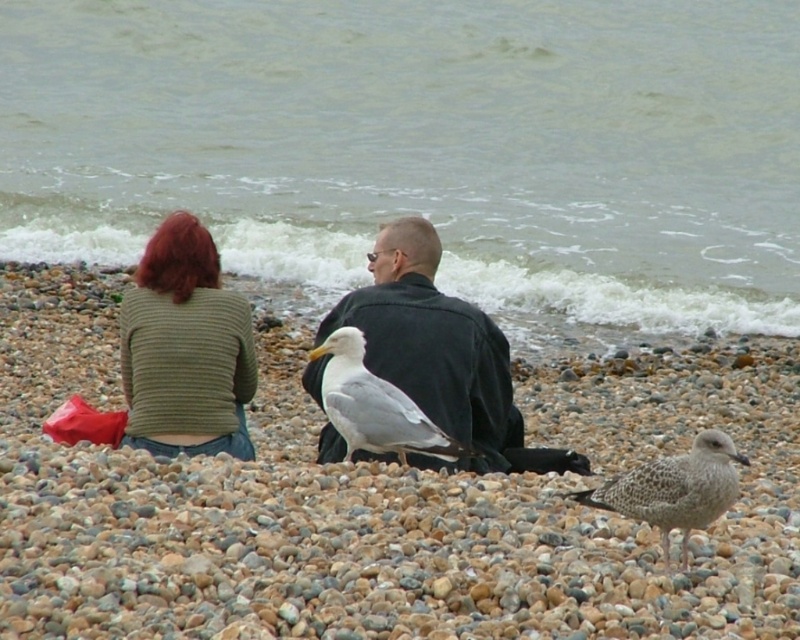
Question: Among these objects, which one is farthest from the camera?

Choices:
 (A) black matte jacket at center
 (B) speckled feathered seagull at lower right
 (C) gray water at center

Answer: (C)

Question: Which point is closer to the camera taking this photo?

Choices:
 (A) (256, 52)
 (B) (440, 429)
 (C) (780, 397)

Answer: (B)

Question: Is smooth pebbles at center to the left of black matte jacket at center from the viewer's perspective?

Choices:
 (A) no
 (B) yes

Answer: (B)

Question: Is green knitted sweater at lower left smaller than speckled feathered seagull at lower right?

Choices:
 (A) no
 (B) yes

Answer: (A)

Question: Does smooth pebbles at center have a greater width compared to black matte jacket at center?

Choices:
 (A) no
 (B) yes

Answer: (A)

Question: Which object appears farthest from the camera in this image?

Choices:
 (A) speckled feathered seagull at lower right
 (B) black matte jacket at center
 (C) smooth pebbles at center

Answer: (B)